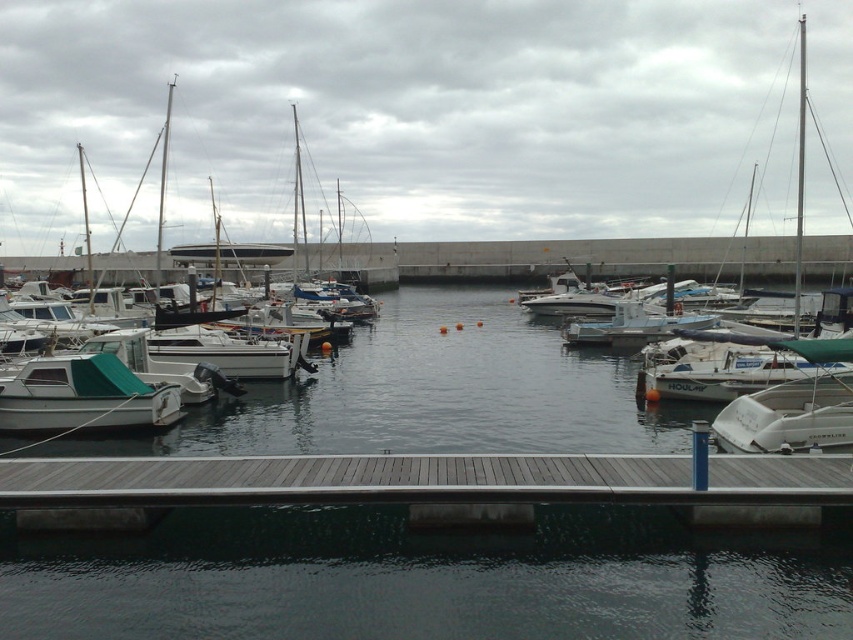
You are a photographer planning to capture the marina scene. You want to ensure that the clear water at center and the white matte boat at left are both visible in your shot. Based on their sizes, which object would occupy more of the frame?

The clear water at center occupies more of the frame because it is bigger than the white matte boat at left according to the description.

You are a dock worker who needs to secure both the white matte sailboat at left and the white matte boat at left. Which one requires more vertical clearance due to its height?

The white matte sailboat at left requires more vertical clearance because it is taller than the white matte boat at left.

You are a boat operator who needs to navigate a new vessel into the marina. The new vessel requires a minimum of 30 feet of space to maneuver safely. Based on the scene, is there enough space between the white matte sailboat at left and the white matte boat at left to safely maneuver your vessel?

The distance between the white matte sailboat at left and the white matte boat at left is 29.36 feet, which is less than the required 30 feet. Therefore, there is insufficient space to safely maneuver the vessel between them.